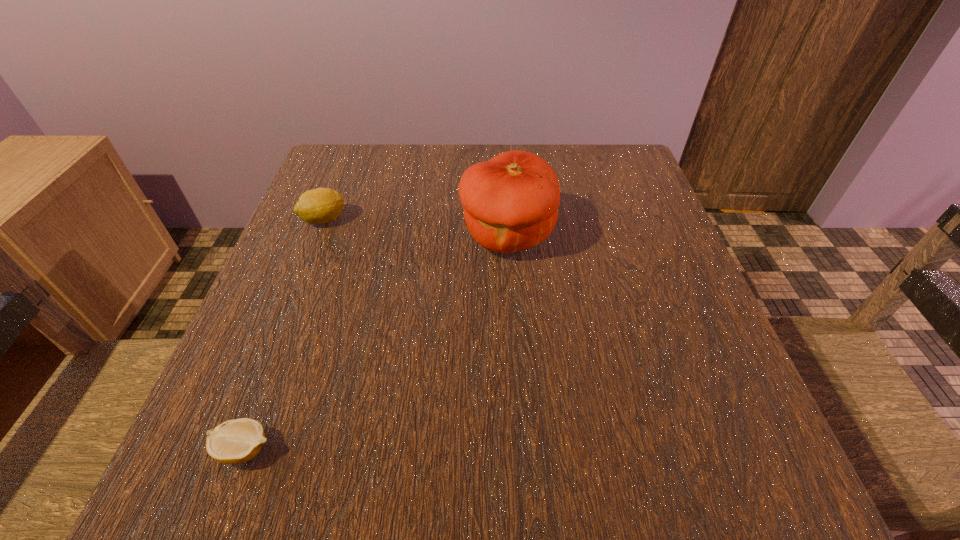
The height and width of the screenshot is (540, 960). Find the location of `object situated at the near left corner`. object situated at the near left corner is located at coordinates (237, 441).

Locate an element on the screen. This screenshot has width=960, height=540. vacant region at the far edge is located at coordinates (402, 186).

The image size is (960, 540). I want to click on free region at the near edge, so click(x=482, y=501).

Locate an element on the screen. This screenshot has width=960, height=540. vacant space at the left edge of the desktop is located at coordinates (345, 224).

Identify the location of free space at the right edge of the desktop. This screenshot has width=960, height=540. (691, 323).

Identify the location of vacant space at the far left corner of the desktop. The image size is (960, 540). [352, 171].

I want to click on vacant space at the far right corner of the desktop, so click(617, 167).

Where is `vacant point located between the nearest object and the rightmost object`? The height and width of the screenshot is (540, 960). vacant point located between the nearest object and the rightmost object is located at coordinates (375, 342).

The image size is (960, 540). In order to click on blank region between the shortest object and the farther lemon in this screenshot , I will do `click(284, 334)`.

Find the location of a particular element. This screenshot has width=960, height=540. unoccupied position between the taller lemon and the nearer lemon is located at coordinates (284, 334).